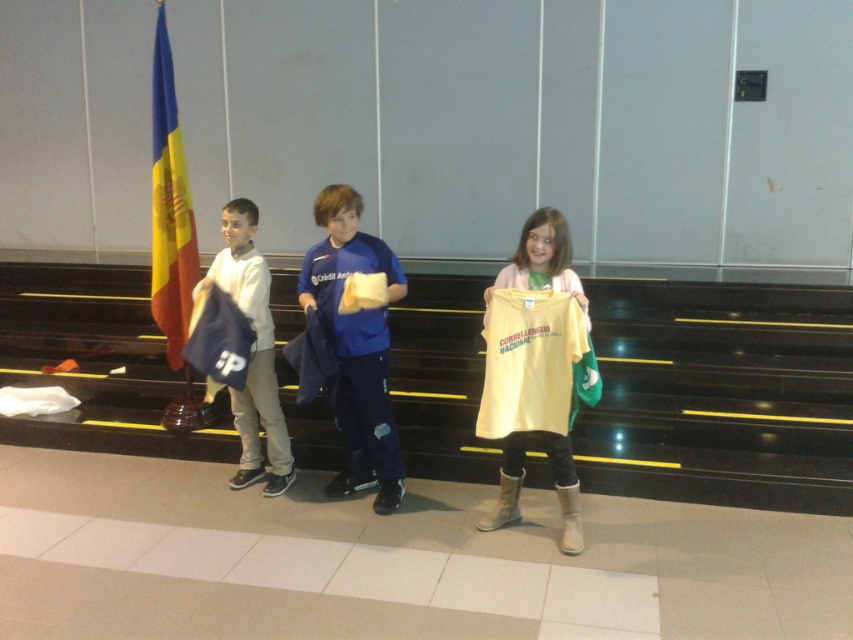
Who is more distant from viewer, (596, 384) or (184, 248)?

Positioned behind is point (184, 248).

The height and width of the screenshot is (640, 853). Identify the location of yellow matte shirt at center. (572, 362).

Based on the photo, can you confirm if blue fabric jacket at center is positioned to the right of blue and yellow fabric flag at left?

Yes, blue fabric jacket at center is to the right of blue and yellow fabric flag at left.

From the picture: Measure the distance from blue fabric jacket at center to blue and yellow fabric flag at left.

The distance of blue fabric jacket at center from blue and yellow fabric flag at left is 1.23 meters.

The image size is (853, 640). What do you see at coordinates (357, 346) in the screenshot?
I see `blue fabric jacket at center` at bounding box center [357, 346].

I want to click on blue fabric jacket at center, so click(x=357, y=346).

Consider the image. Is black glossy stairs at center behind blue and yellow fabric flag at left?

No, it is not.

Is black glossy stairs at center in front of blue and yellow fabric flag at left?

That is True.

At what (x,y) coordinates should I click in order to perform the action: click on black glossy stairs at center. Please return your answer as a coordinate pair (x, y). Looking at the image, I should click on (720, 394).